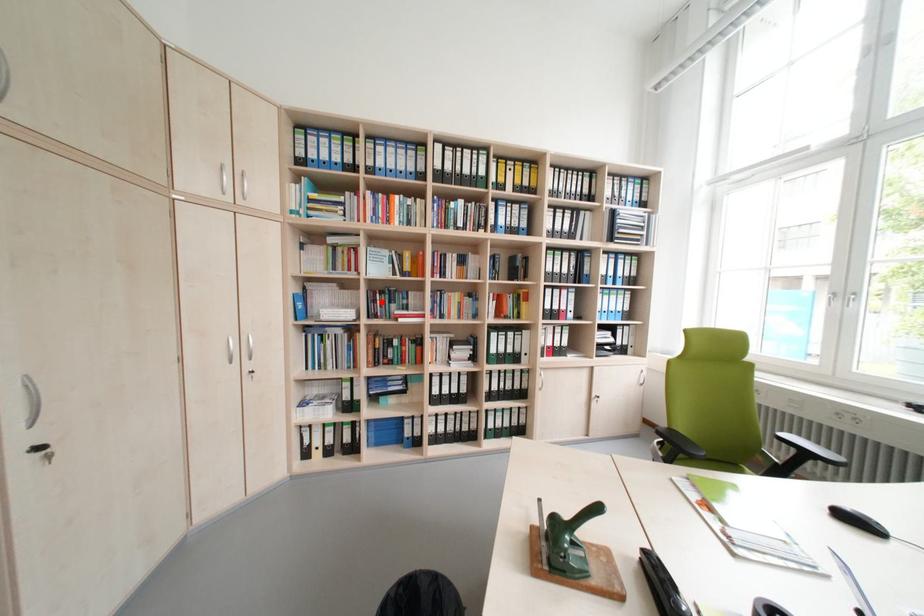
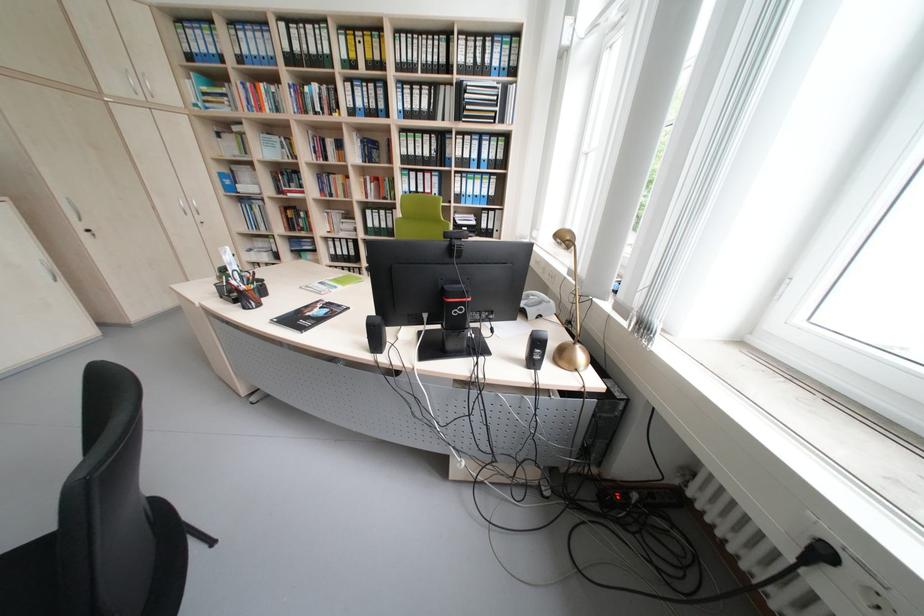
Question: I am providing you with two images of the same scene from different viewpoints. A red point is marked on the first image. Is the red point's position out of view in image 2?

Choices:
 (A) Yes
 (B) No

Answer: (B)